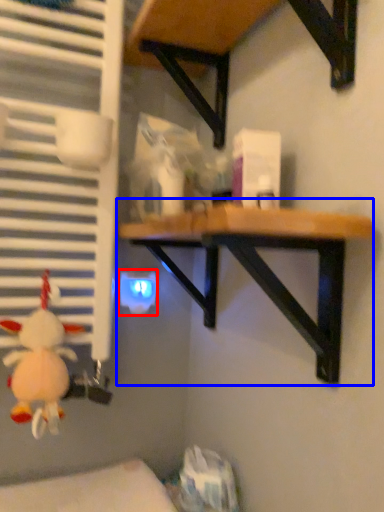
Question: Which point is closer to the camera, electric outlet (highlighted by a red box) or table (highlighted by a blue box)?

Choices:
 (A) electric outlet
 (B) table

Answer: (B)